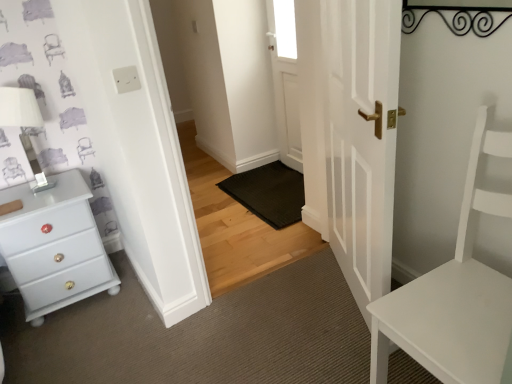
Question: From the image's perspective, is matte white chest of drawers at left located above white glossy door at center, the 1th door positioned from the front?

Choices:
 (A) yes
 (B) no

Answer: (B)

Question: Can you confirm if matte white chest of drawers at left is shorter than white glossy door at center, positioned as the 2th door in back-to-front order?

Choices:
 (A) no
 (B) yes

Answer: (B)

Question: Is the position of matte white chest of drawers at left more distant than that of white glossy door at center, the 1th door positioned from the front?

Choices:
 (A) no
 (B) yes

Answer: (B)

Question: Can white glossy door at center, positioned as the 2th door in back-to-front order, be found inside matte white chest of drawers at left?

Choices:
 (A) no
 (B) yes

Answer: (A)

Question: Is matte white chest of drawers at left thinner than white glossy door at center, the 1th door positioned from the front?

Choices:
 (A) no
 (B) yes

Answer: (A)

Question: Based on their positions, is white glossy door at center, the 1th door positioned from the front, located to the left or right of white wooden door at center, which is the 1th door in back-to-front order?

Choices:
 (A) left
 (B) right

Answer: (B)

Question: Considering the positions of white glossy door at center, positioned as the 2th door in back-to-front order, and white wooden door at center, which is the 1th door in back-to-front order, in the image, is white glossy door at center, positioned as the 2th door in back-to-front order, taller or shorter than white wooden door at center, which is the 1th door in back-to-front order,?

Choices:
 (A) tall
 (B) short

Answer: (A)

Question: From the image's perspective, is white glossy door at center, the 1th door positioned from the front, above or below white wooden door at center, which is the 1th door in back-to-front order?

Choices:
 (A) below
 (B) above

Answer: (A)

Question: Relative to white wooden door at center, placed as the 2th door when sorted from front to back, is white glossy door at center, positioned as the 2th door in back-to-front order, in front or behind?

Choices:
 (A) front
 (B) behind

Answer: (A)

Question: From the image's perspective, is white glossy door at center, positioned as the 2th door in back-to-front order, above or below white matte chair at right?

Choices:
 (A) below
 (B) above

Answer: (B)

Question: Looking at their shapes, would you say white glossy door at center, the 1th door positioned from the front, is wider or thinner than white matte chair at right?

Choices:
 (A) thin
 (B) wide

Answer: (A)

Question: Does point (396, 94) appear closer or farther from the camera than point (394, 339)?

Choices:
 (A) closer
 (B) farther

Answer: (B)

Question: Is white glossy door at center, positioned as the 2th door in back-to-front order, bigger or smaller than white matte chair at right?

Choices:
 (A) big
 (B) small

Answer: (B)

Question: In terms of height, does white wooden door at center, which is the 1th door in back-to-front order, look taller or shorter compared to white glossy door at center, positioned as the 2th door in back-to-front order?

Choices:
 (A) short
 (B) tall

Answer: (A)

Question: Which is correct: white wooden door at center, which is the 1th door in back-to-front order, is inside white glossy door at center, positioned as the 2th door in back-to-front order, or outside of it?

Choices:
 (A) inside
 (B) outside

Answer: (B)